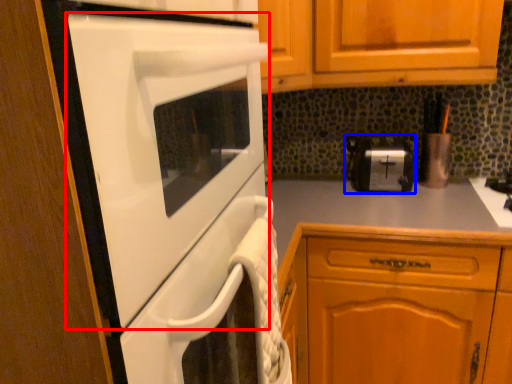
Question: Which point is further to the camera, home appliance (highlighted by a red box) or toaster (highlighted by a blue box)?

Choices:
 (A) home appliance
 (B) toaster

Answer: (B)